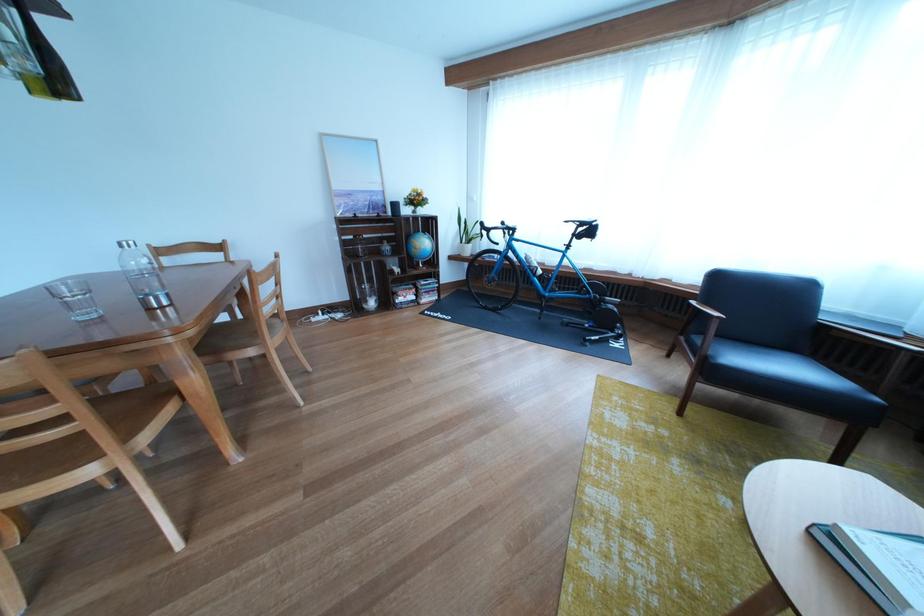
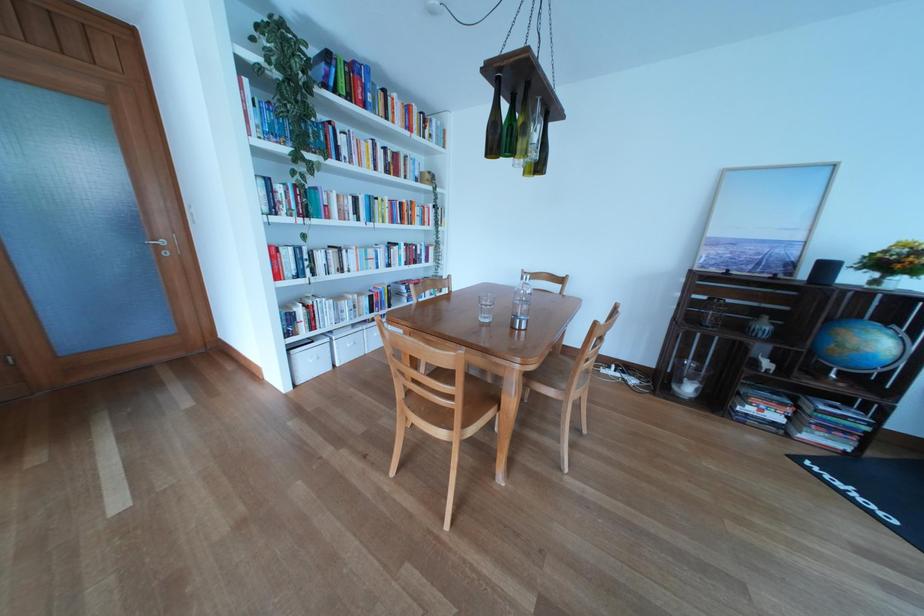
In the second image, find the point that corresponds to point (73, 426) in the first image.

(464, 403)